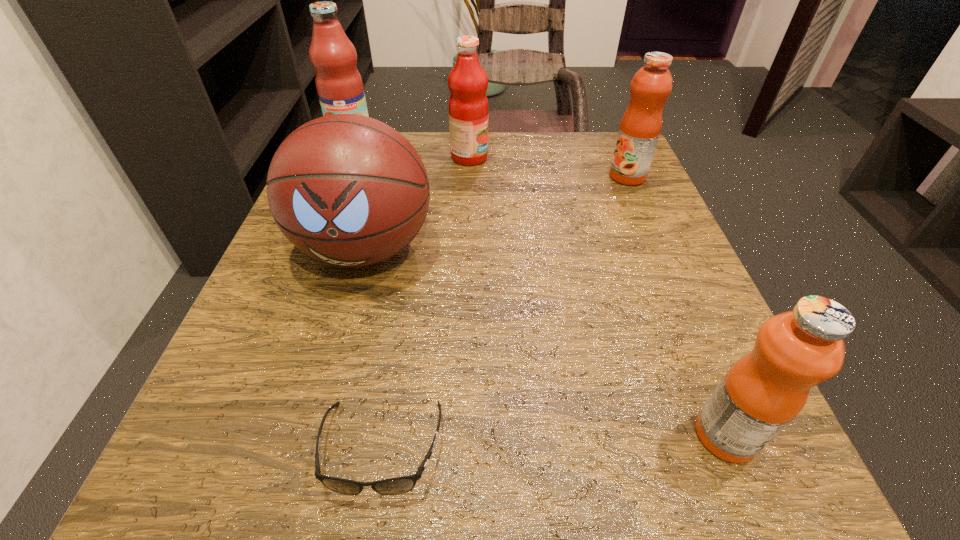
The height and width of the screenshot is (540, 960). Find the location of `fruit juice that is the third closest to the third fruit juice from right to left`. fruit juice that is the third closest to the third fruit juice from right to left is located at coordinates (763, 391).

You are a GUI agent. You are given a task and a screenshot of the screen. Output one action in this format:
    pyautogui.click(x=<x>, y=<y>)
    Task: Click on the fruit juice that is the third nearest to the basketball
    This screenshot has width=960, height=540.
    Given the screenshot: What is the action you would take?
    pyautogui.click(x=640, y=127)

Where is `free space that satisfies the following two spatial constraints: 1. on the front label of the leftmost fruit juice; 2. on the right side of the nearest fruit juice`? free space that satisfies the following two spatial constraints: 1. on the front label of the leftmost fruit juice; 2. on the right side of the nearest fruit juice is located at coordinates (231, 435).

Locate an element on the screen. free space that satisfies the following two spatial constraints: 1. on the front label of the leftmost fruit juice; 2. on the left side of the basketball is located at coordinates (309, 248).

Identify the location of vacant position in the image that satisfies the following two spatial constraints: 1. on the front label of the nearest fruit juice; 2. on the right side of the second fruit juice from left to right. (461, 435).

Image resolution: width=960 pixels, height=540 pixels. What are the coordinates of `vacant space that satisfies the following two spatial constraints: 1. on the front label of the third fruit juice from right to left; 2. on the back side of the nearest fruit juice` in the screenshot? It's located at (461, 435).